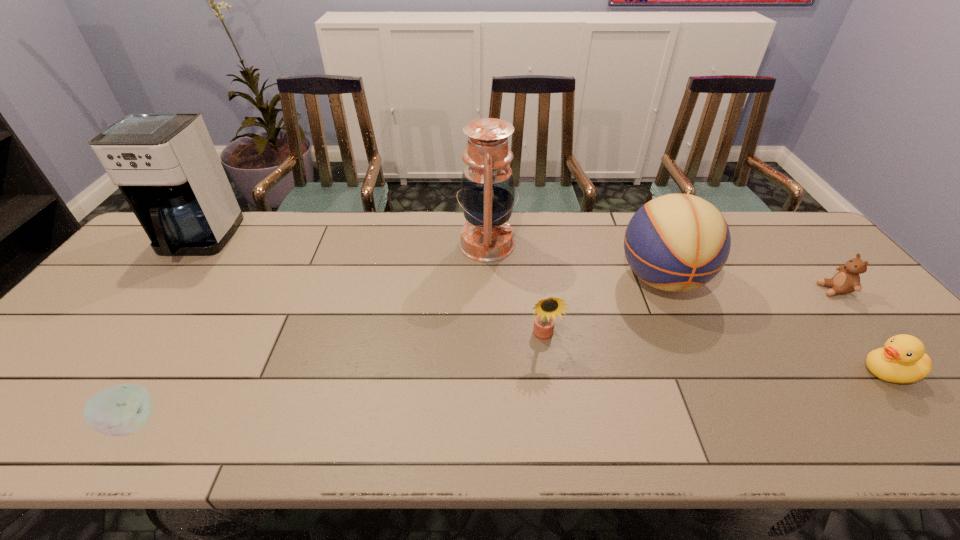
Where is `free space located 0.210m on the back of the nearest object`? This screenshot has width=960, height=540. free space located 0.210m on the back of the nearest object is located at coordinates (192, 329).

What are the coordinates of `oil lamp present at the far edge` in the screenshot? It's located at (487, 191).

At what (x,y) coordinates should I click in order to perform the action: click on coffee maker at the far edge. Please return your answer as a coordinate pair (x, y). The height and width of the screenshot is (540, 960). Looking at the image, I should click on (165, 164).

The height and width of the screenshot is (540, 960). Find the location of `basketball that is positioned at the far edge`. basketball that is positioned at the far edge is located at coordinates (677, 242).

This screenshot has height=540, width=960. In order to click on object located in the near edge section of the desktop in this screenshot , I will do `click(122, 410)`.

Image resolution: width=960 pixels, height=540 pixels. Find the location of `object present at the left edge`. object present at the left edge is located at coordinates (165, 164).

Image resolution: width=960 pixels, height=540 pixels. Identify the location of teddy bear located at the right edge. (847, 280).

Where is `duck that is positioned at the right edge`? The height and width of the screenshot is (540, 960). duck that is positioned at the right edge is located at coordinates (903, 359).

Locate an element on the screen. This screenshot has width=960, height=540. object at the far left corner is located at coordinates (165, 164).

In the image, there is a desktop. At what (x,y) coordinates should I click in order to perform the action: click on vacant space at the far edge. Please return your answer as a coordinate pair (x, y). Looking at the image, I should click on (337, 241).